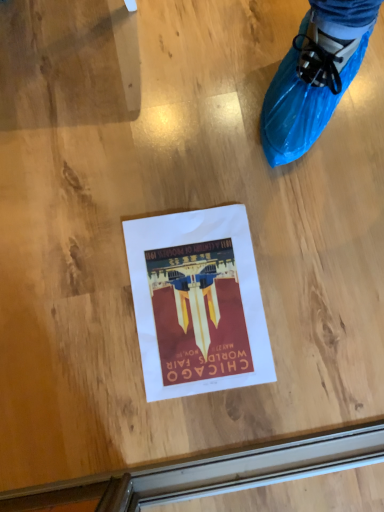
Locate an element on the screen. The width and height of the screenshot is (384, 512). vacant area on top of matte paper poster at center (from a real-world perspective) is located at coordinates (207, 297).